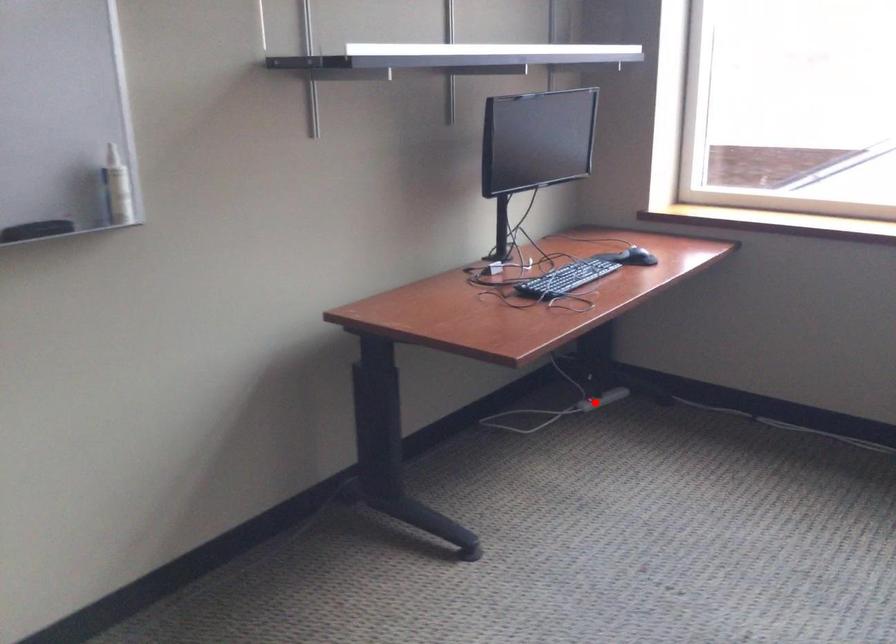
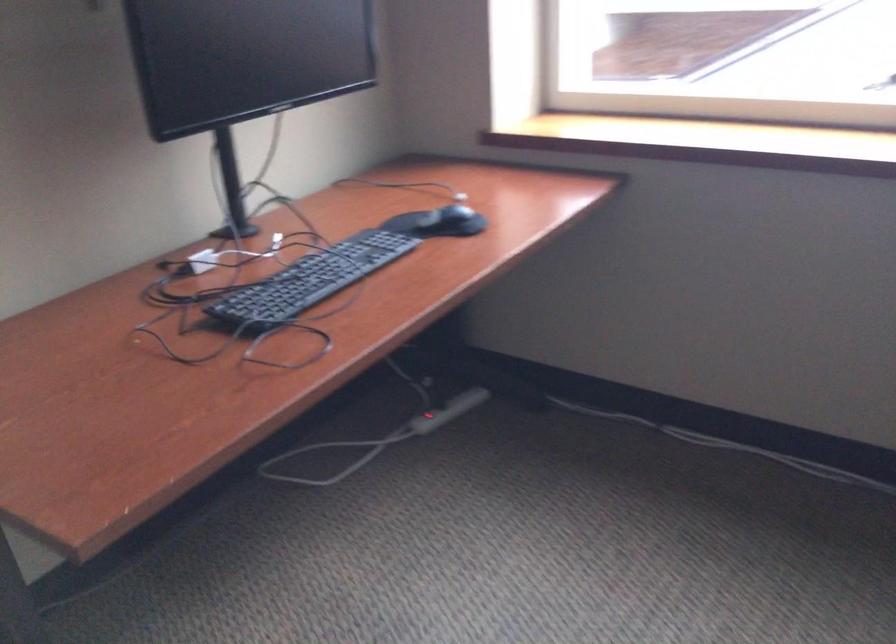
Find the pixel in the second image that matches the highlighted location in the first image.

(428, 421)